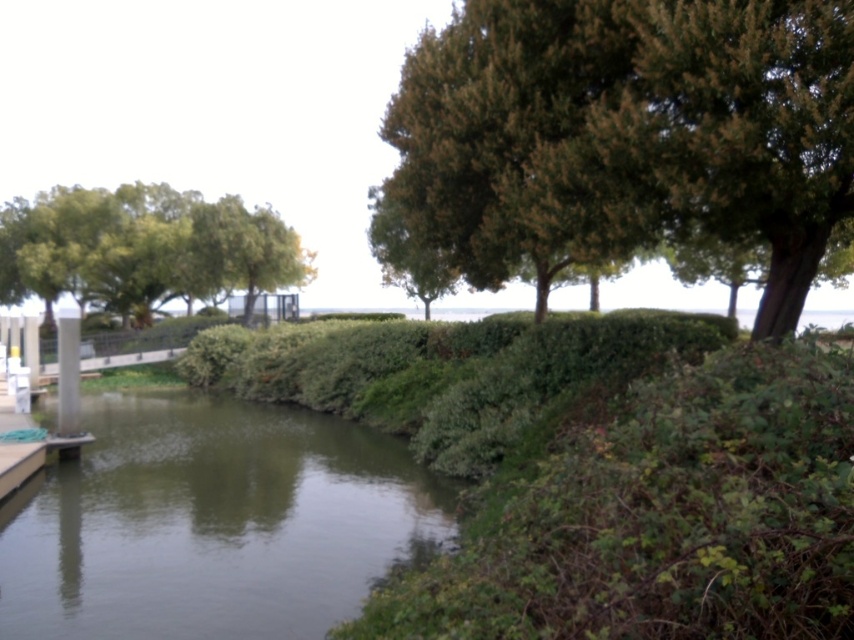
Question: Which point is closer to the camera?

Choices:
 (A) (154, 250)
 (B) (191, 518)
 (C) (392, 118)

Answer: (B)

Question: Can you confirm if green grassy river at lower left is thinner than green leafy tree at left?

Choices:
 (A) yes
 (B) no

Answer: (A)

Question: Which point is closer to the camera?

Choices:
 (A) green grassy river at lower left
 (B) green leafy tree at upper right
 (C) green leafy tree at left

Answer: (A)

Question: Which point is farther from the camera taking this photo?

Choices:
 (A) (91, 198)
 (B) (676, 26)
 (C) (208, 570)

Answer: (A)

Question: In this image, where is green grassy river at lower left located relative to green leafy tree at left?

Choices:
 (A) below
 (B) above

Answer: (A)

Question: Is green leafy tree at upper right below green grassy river at lower left?

Choices:
 (A) no
 (B) yes

Answer: (A)